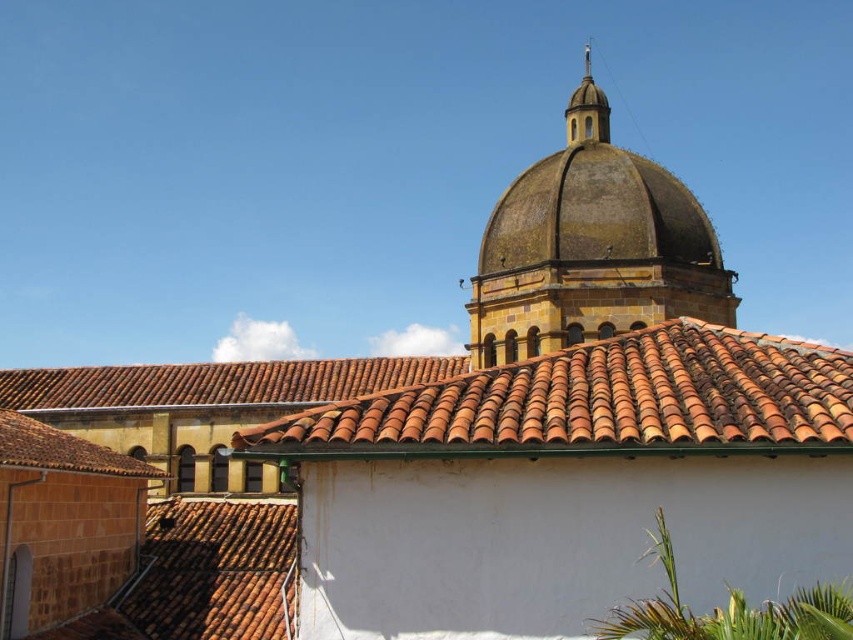
You are an architect analyzing the building structure. You observe the brown textured dome at center and the smooth gold dome at upper center. Which dome has a larger size?

The brown textured dome at center is bigger than the smooth gold dome at upper center, so the brown textured dome at center has a larger size.

You are standing in front of the historic building and want to locate two specific points marked on the image. The first point is at coordinates point (297, 433) and the second is at point (590, 113). Which point is closer to you?

Point (297, 433) is in front of point (590, 113), so the first point is closer to you.

You are a drone operator planning to fly a drone from the brown textured dome at center to the nearest building with a tiled roof. The drone has a maximum flight range of 30 meters. Will it be able to reach the destination?

The distance between the brown textured dome at center and the nearest building with a tiled roof is 33.42 meters, which exceeds the drone operator drone has a maximum flight range of 30 meters. The drone will not be able to reach the destination.